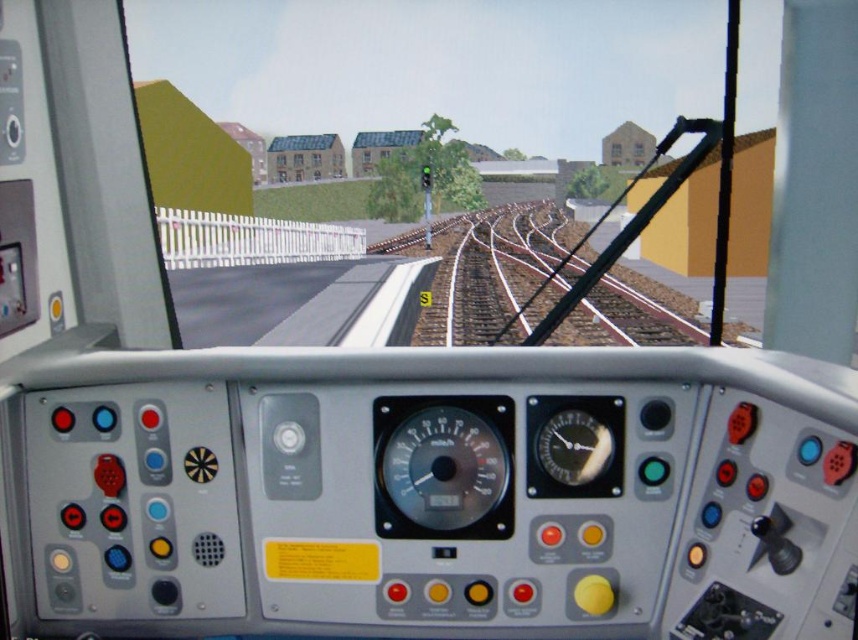
You are the train driver and you need to check the position of point (511, 273). Where exactly is this point located in the scene?

The point (511, 273) is located on the brown wooden train track at center.

You are a train engineer checking the controls. You notice the brown wooden train track at center and the metallic gauge at center. Which object is positioned higher in the driver cabin?

The brown wooden train track at center is located above the metallic gauge at center, so it is positioned higher in the driver cabin.